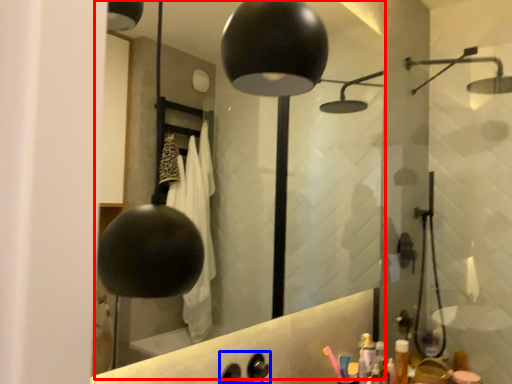
Question: Among these objects, which one is nearest to the camera, mirror (highlighted by a red box) or faucet (highlighted by a blue box)?

Choices:
 (A) mirror
 (B) faucet

Answer: (A)